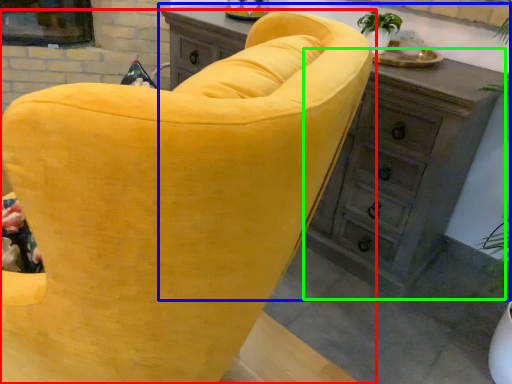
Question: Estimate the real-world distances between objects in this image. Which object is farther from chair (highlighted by a red box), chest of drawers (highlighted by a blue box) or dresser (highlighted by a green box)?

Choices:
 (A) chest of drawers
 (B) dresser

Answer: (A)